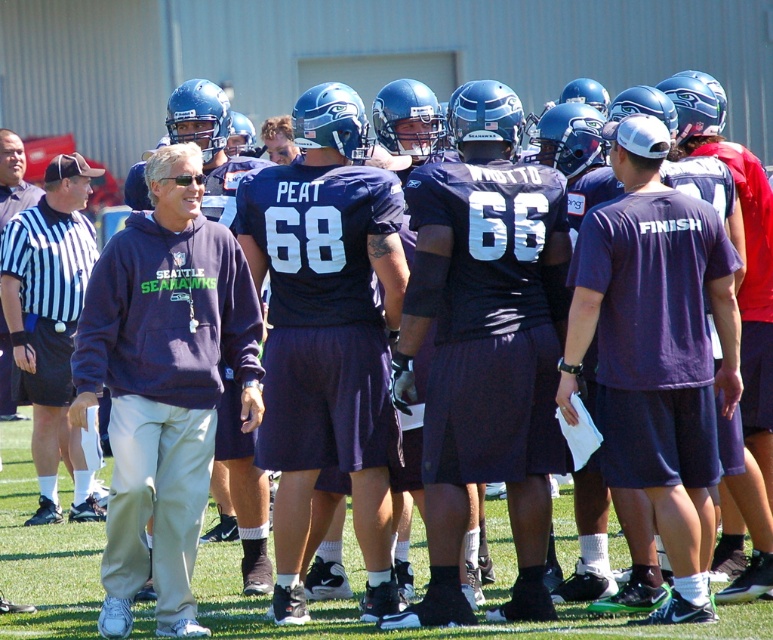
Question: Where is navy fleece sweatshirt at center located in relation to dark blue sweatshirt at left in the image?

Choices:
 (A) left
 (B) right

Answer: (B)

Question: Can you confirm if navy fleece sweatshirt at center is thinner than dark blue sweatshirt at left?

Choices:
 (A) yes
 (B) no

Answer: (B)

Question: Among these objects, which one is farthest from the camera?

Choices:
 (A) dark blue sweatshirt at left
 (B) navy fleece sweatshirt at center

Answer: (A)

Question: Which of the following is the closest to the observer?

Choices:
 (A) (193, 356)
 (B) (9, 336)

Answer: (A)

Question: Is navy fleece sweatshirt at center to the right of dark blue sweatshirt at left from the viewer's perspective?

Choices:
 (A) yes
 (B) no

Answer: (A)